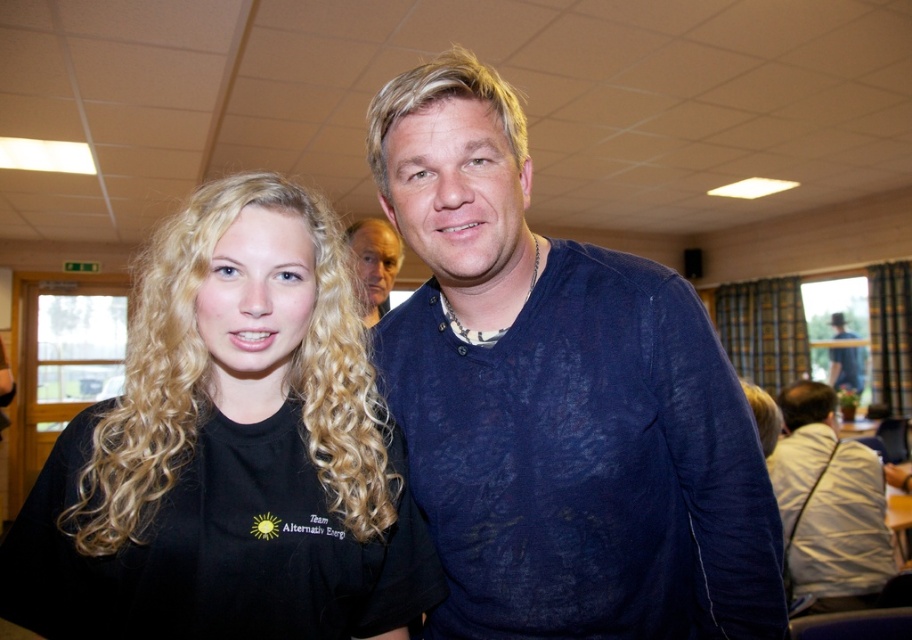
Is blue cotton shirt at center to the left of dark blue shirt at upper right from the viewer's perspective?

Indeed, blue cotton shirt at center is positioned on the left side of dark blue shirt at upper right.

Can you confirm if blue cotton shirt at center is thinner than dark blue shirt at upper right?

No.

The image size is (912, 640). Find the location of `blue cotton shirt at center`. blue cotton shirt at center is located at coordinates (558, 401).

Is blue cotton shirt at center shorter than black matte shirt at left?

Incorrect, blue cotton shirt at center's height does not fall short of black matte shirt at left's.

Who is positioned more to the left, blue cotton shirt at center or black matte shirt at left?

From the viewer's perspective, black matte shirt at left appears more on the left side.

Where is `blue cotton shirt at center`? This screenshot has width=912, height=640. blue cotton shirt at center is located at coordinates (558, 401).

Between blue cotton shirt at center and matte black shirt at center, which one is positioned higher?

matte black shirt at center is higher up.

Is the position of blue cotton shirt at center less distant than that of matte black shirt at center?

Yes, blue cotton shirt at center is closer to the viewer.

What do you see at coordinates (558, 401) in the screenshot?
I see `blue cotton shirt at center` at bounding box center [558, 401].

Where is `blue cotton shirt at center`? blue cotton shirt at center is located at coordinates click(558, 401).